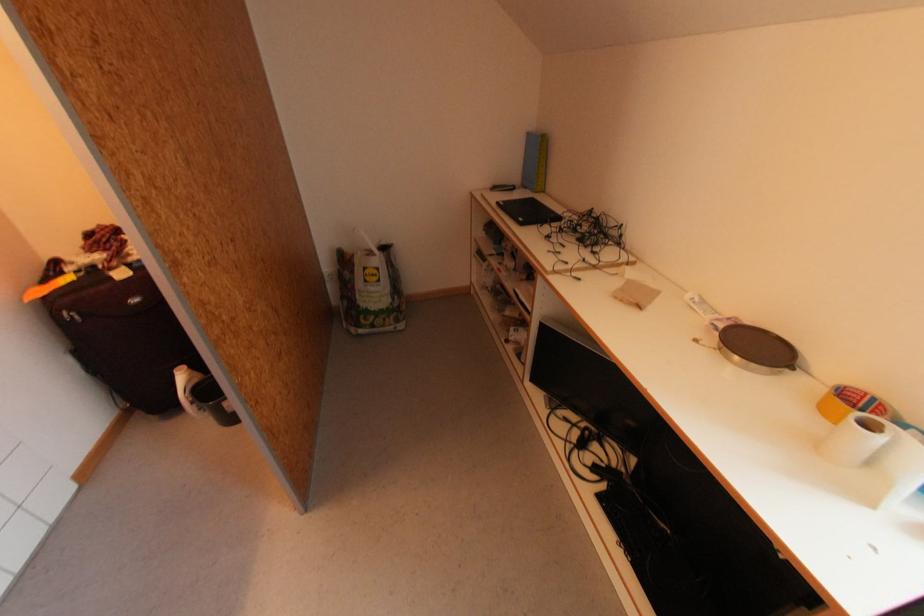
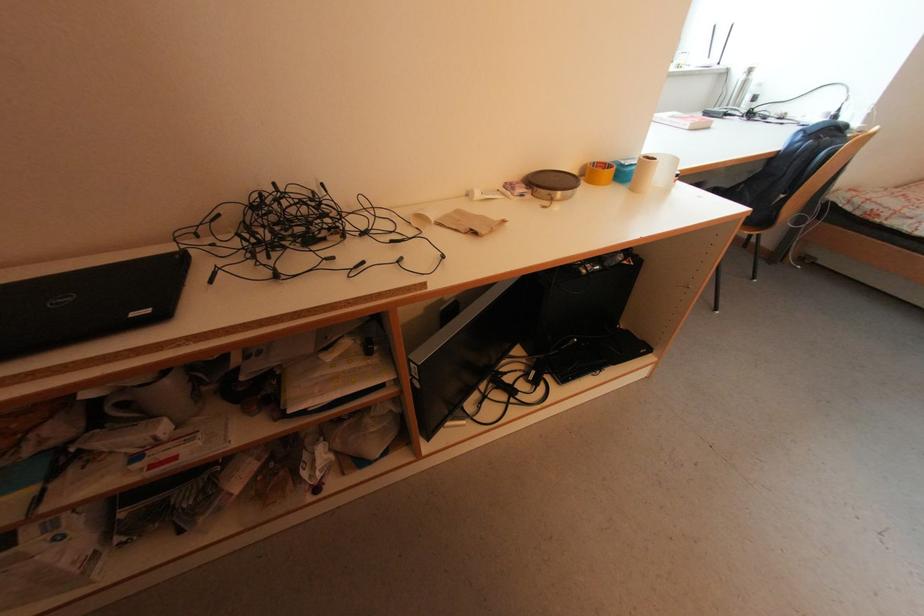
Where in the second image is the point corresponding to (x=527, y=225) from the first image?

(168, 317)